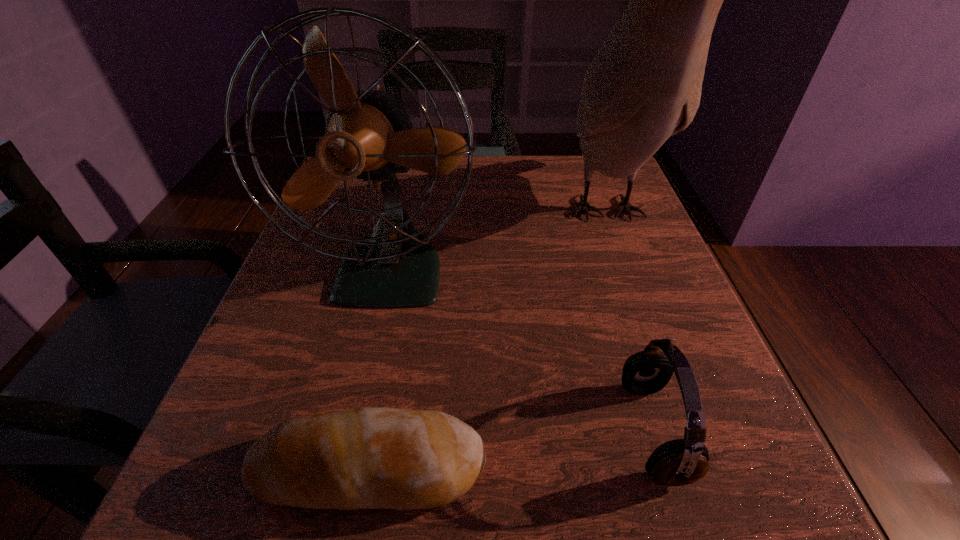
At what (x,y) coordinates should I click in order to perform the action: click on object located in the far edge section of the desktop. Please return your answer as a coordinate pair (x, y). The width and height of the screenshot is (960, 540). Looking at the image, I should click on [644, 85].

Find the location of a particular element. This screenshot has width=960, height=540. headset that is at the near edge is located at coordinates (x=678, y=462).

You are a GUI agent. You are given a task and a screenshot of the screen. Output one action in this format:
    pyautogui.click(x=<x>, y=<y>)
    Task: Click on the bread situated at the near edge
    Image resolution: width=960 pixels, height=540 pixels.
    Given the screenshot: What is the action you would take?
    pyautogui.click(x=361, y=458)

The height and width of the screenshot is (540, 960). I want to click on fan positioned at the left edge, so click(369, 135).

Locate an element on the screen. This screenshot has height=540, width=960. bread positioned at the left edge is located at coordinates (361, 458).

I want to click on parakeet that is at the right edge, so click(644, 85).

Find the location of a particular element. headset present at the right edge is located at coordinates (678, 462).

Where is `object that is at the near left corner`? This screenshot has width=960, height=540. object that is at the near left corner is located at coordinates (361, 458).

The width and height of the screenshot is (960, 540). I want to click on object located at the far right corner, so click(x=644, y=85).

At what (x,y) coordinates should I click in order to perform the action: click on object located at the near right corner. Please return your answer as a coordinate pair (x, y). The height and width of the screenshot is (540, 960). Looking at the image, I should click on (678, 462).